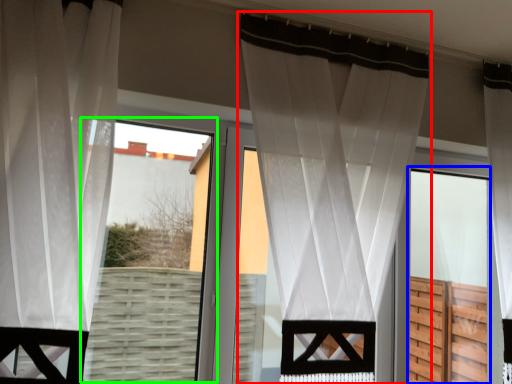
Question: Estimate the real-world distances between objects in this image. Which object is closer to curtain (highlighted by a red box), screen door (highlighted by a blue box) or bay window (highlighted by a green box)?

Choices:
 (A) screen door
 (B) bay window

Answer: (A)